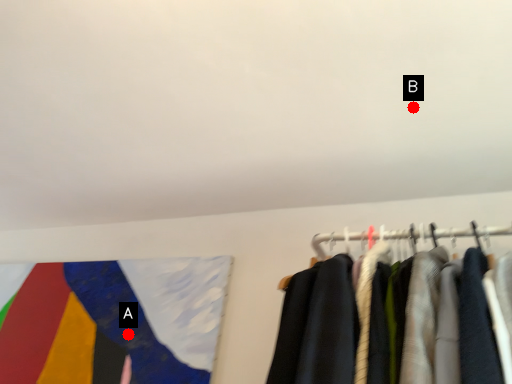
Question: Two points are circled on the image, labeled by A and B beside each circle. Which point is farther from the camera taking this photo?

Choices:
 (A) A is further
 (B) B is further

Answer: (A)